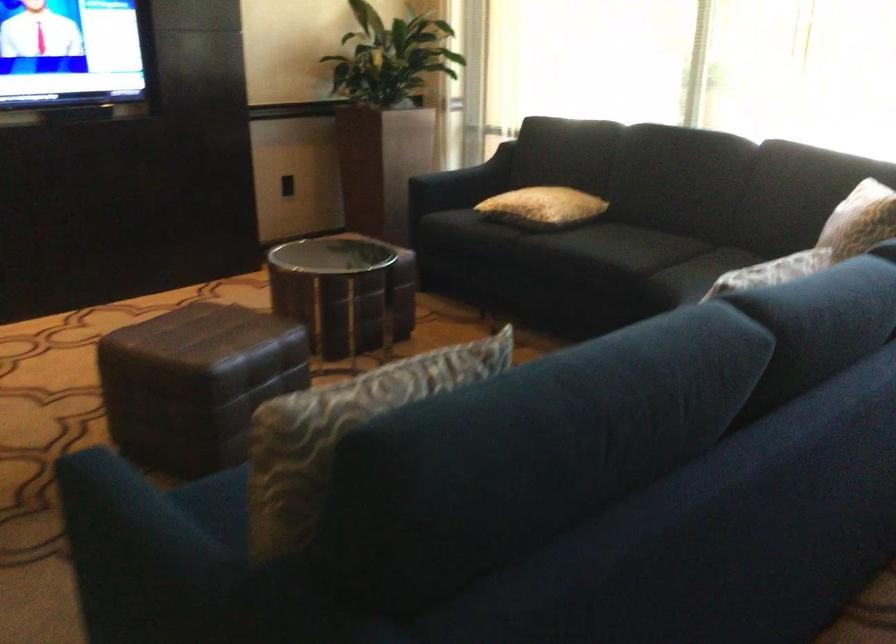
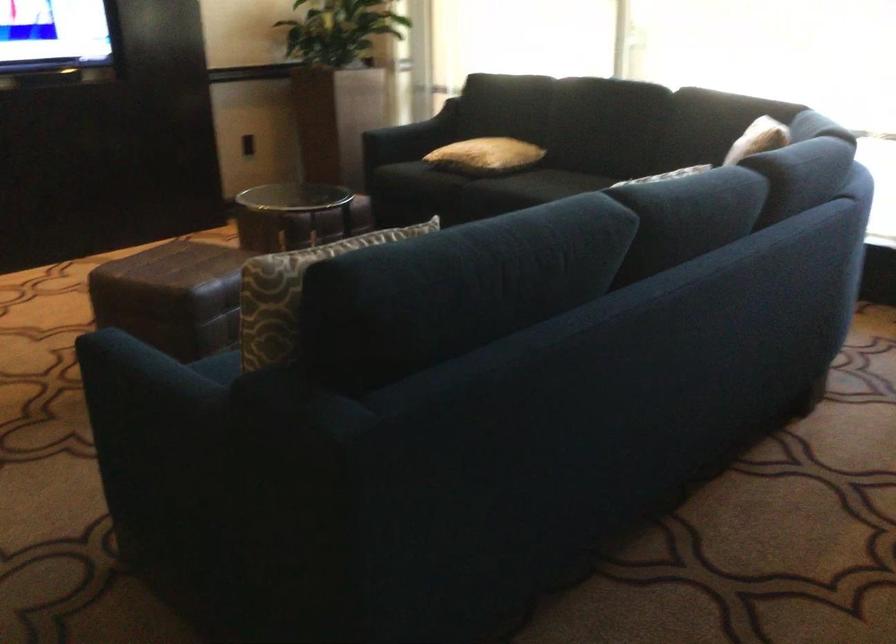
Question: What movement of the cameraman would produce the second image?

Choices:
 (A) Left
 (B) Right
 (C) Forward
 (D) Backward

Answer: (D)